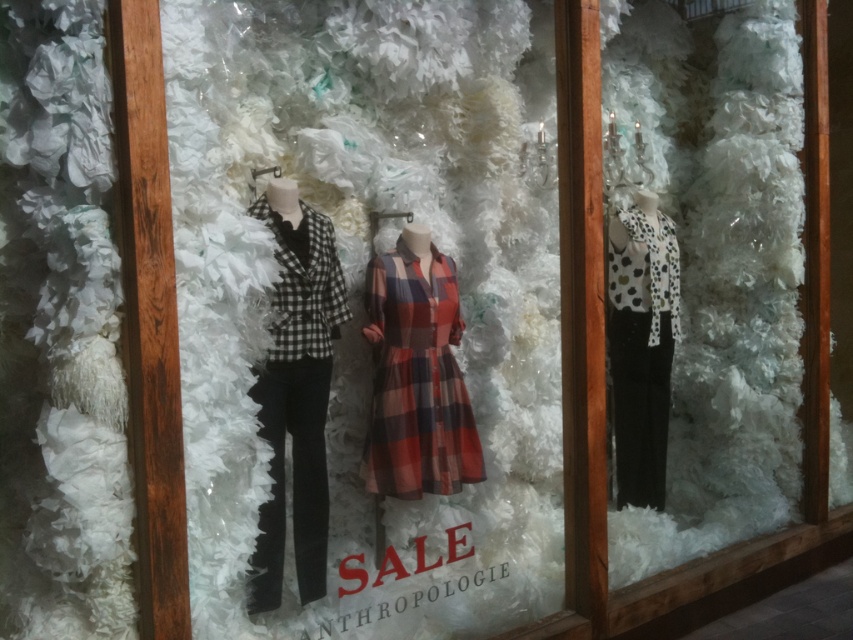
Based on the photo, you are standing in front of the Anthropologie retail display window and notice two points marked on the window. The first point is at coordinates point (x=332, y=227) and the second is at point (x=369, y=484). If you want to touch the point that is closer to you, which coordinate should you aim for?

The point at coordinates point (x=332, y=227) is closer to you than point (x=369, y=484), so you should aim for point (x=332, y=227).

Looking at this image, you are a customer trying to decide which outfit to try on next. The salesperson tells you that the plaid cotton dress at center is wider than the white dotted fabric top at right. Based on this information, which outfit would require more space to move comfortably in the fitting room?

The plaid cotton dress at center is wider than the white dotted fabric top at right, so it would require more space to move comfortably in the fitting room.

You are standing in front of the Anthropologie display window and want to measure the distance between the two mannequins. If the distance between the point at (392,390) and the other mannequin is 9.02 feet, which mannequin is farther from the point?

The mannequin on the right is farther from the point at (392,390) because they are 9.02 feet apart.